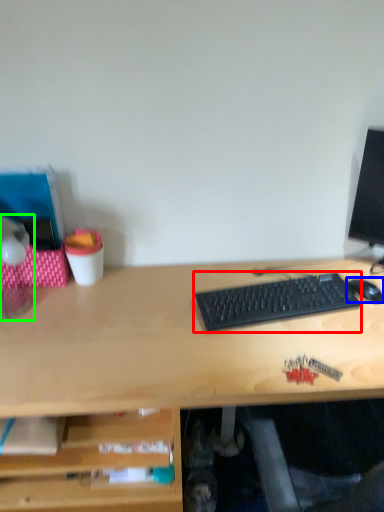
Question: Considering the real-world distances, which object is closest to computer keyboard (highlighted by a red box)? mouse (highlighted by a blue box) or table lamp (highlighted by a green box).

Choices:
 (A) mouse
 (B) table lamp

Answer: (A)